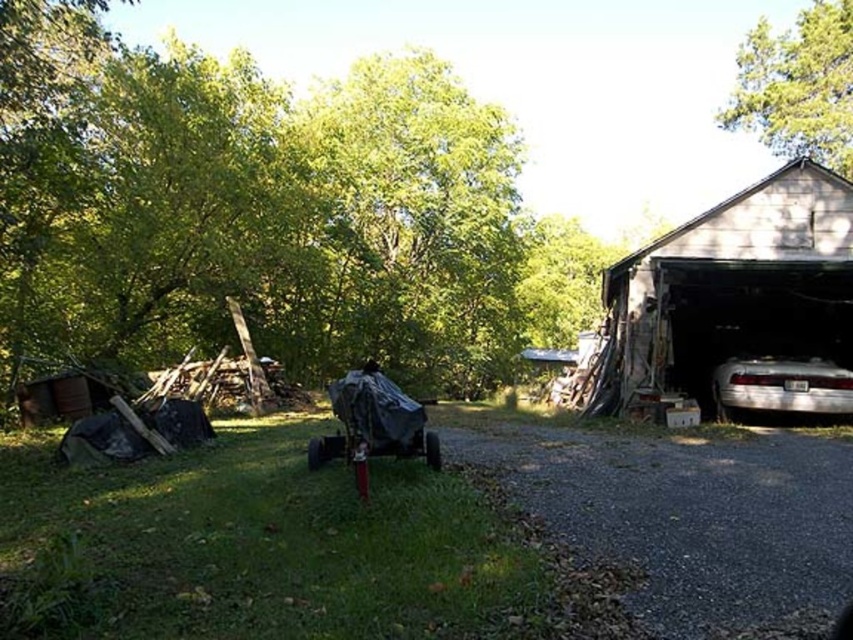
You are standing at the origin point of the image. Which direction should you move to reach the white wood barn at right?

The white wood barn at right is located at coordinate point 0.477 on the x axis and 0.866 on the y axis. Since the origin point is typically the bottom left corner of an image, moving towards the right and upwards would lead you to the white wood barn at right.

You are a delivery person trying to park your delivery van, which is 6 meters long, in the driveway. The gray gravel driveway at lower right and the silver metallic car at lower right are both in your way. Which one is shorter and can be moved to make space?

The gray gravel driveway at lower right is shorter than the silver metallic car at lower right, so you can move the gray gravel driveway at lower right to make space.